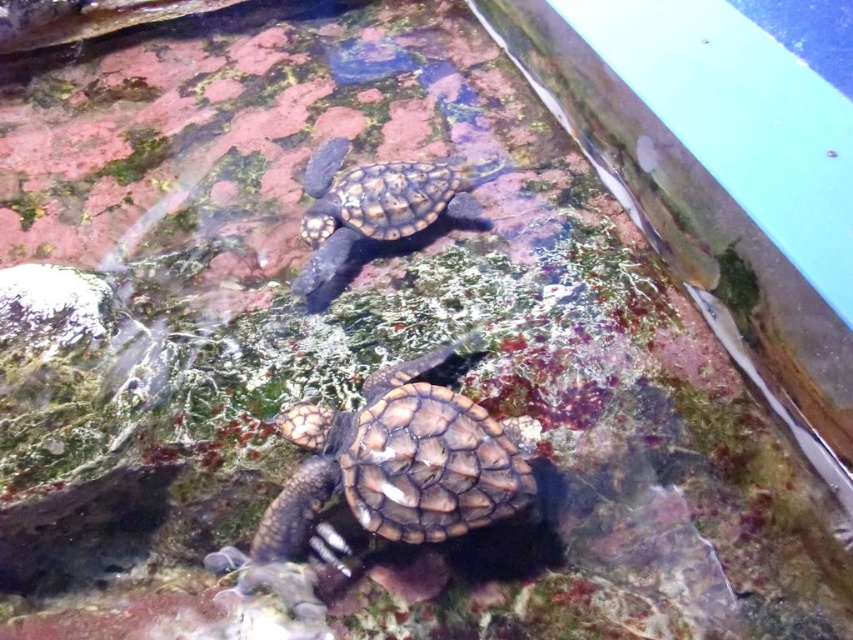
What do you see at coordinates (393, 467) in the screenshot? The image size is (853, 640). I see `brown scaly tortoise at center` at bounding box center [393, 467].

Can you confirm if brown scaly tortoise at center is positioned to the left of leathery brown tortoise at upper center?

No, brown scaly tortoise at center is not to the left of leathery brown tortoise at upper center.

Which is in front, point (426, 408) or point (399, 200)?

Positioned in front is point (426, 408).

This screenshot has width=853, height=640. Find the location of `brown scaly tortoise at center`. brown scaly tortoise at center is located at coordinates (393, 467).